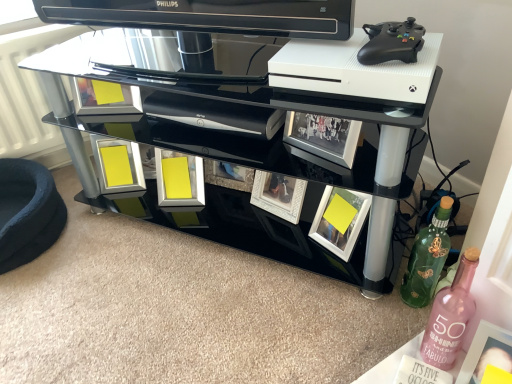
Locate an element on the screen. This screenshot has height=384, width=512. vacant space that is in between yellow matte picture frame at lower right, which ranks as the second picture frame in front-to-back order, and velvet cushion at lower left is located at coordinates (168, 246).